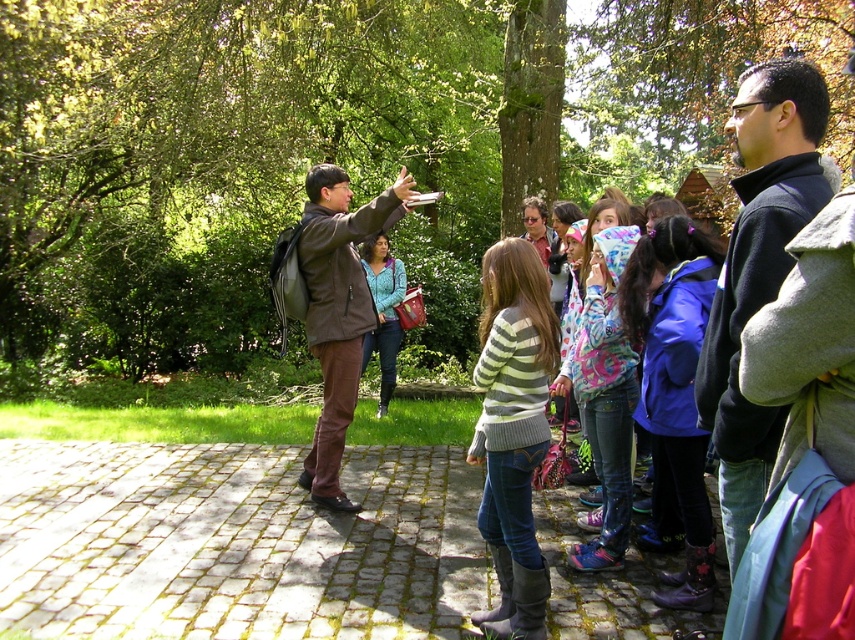
You are a photographer who wants to take a photo of the striped sweater at center from your camera. The camera has a minimum focusing distance of 4 meters. Can you take the photo without moving either the camera or the sweater?

The striped sweater at center and camera are 3.86 meters apart from each other. Since the minimum focusing distance is 4 meters, the camera cannot focus on the striped sweater at center as it is too close.

Based on the photo, you are a photographer trying to capture both the dark blue fleece jacket at center and the striped sweater at center in a single shot. Which one will appear larger in the photo?

The dark blue fleece jacket at center will appear larger in the photo because it is closer to the viewer than the striped sweater at center.